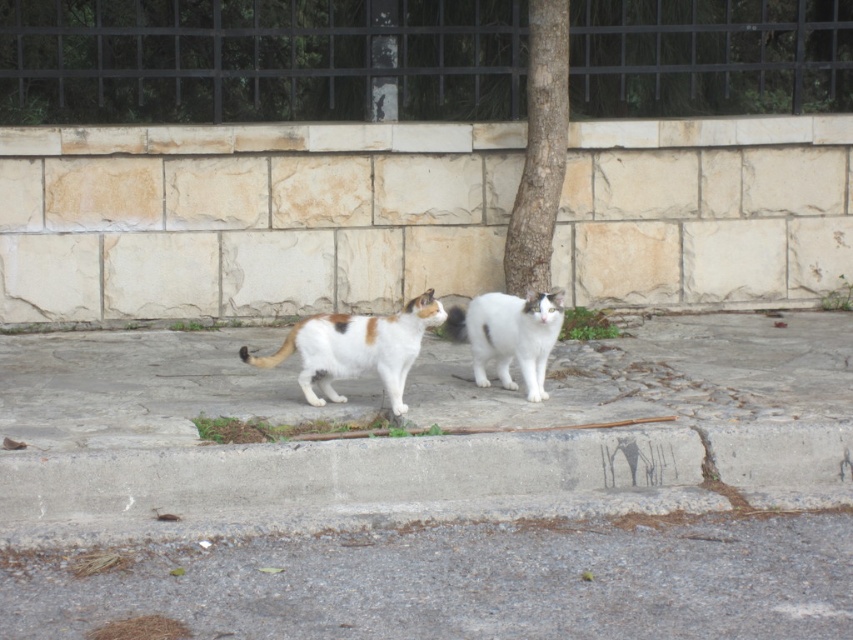
Based on the photo, which of these two, gray asphalt at lower center or smooth bark tree at center, stands shorter?

gray asphalt at lower center

Does gray asphalt at lower center lie behind smooth bark tree at center?

That is False.

Locate an element on the screen. The image size is (853, 640). gray asphalt at lower center is located at coordinates (463, 580).

Find the location of a particular element. The height and width of the screenshot is (640, 853). gray asphalt at lower center is located at coordinates (463, 580).

Can you confirm if gray asphalt at lower center is taller than white fur cat at center?

No.

Between gray asphalt at lower center and white fur cat at center, which one is positioned higher?

white fur cat at center is above.

Which is in front, point (287, 538) or point (326, 324)?

Point (287, 538) is in front.

Image resolution: width=853 pixels, height=640 pixels. What are the coordinates of `gray asphalt at lower center` in the screenshot? It's located at (463, 580).

Can you confirm if concrete at lower center is smaller than white fluffy cat at center?

Incorrect, concrete at lower center is not smaller in size than white fluffy cat at center.

Does concrete at lower center have a larger size compared to white fluffy cat at center?

Yes.

Is point (44, 525) positioned before point (535, 321)?

Yes, point (44, 525) is in front of point (535, 321).

Image resolution: width=853 pixels, height=640 pixels. I want to click on concrete at lower center, so click(x=421, y=481).